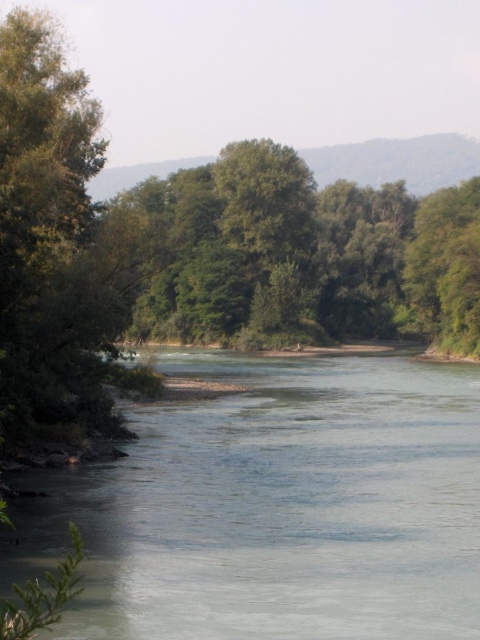
You are standing at the edge of the river and want to cross to the other side. You see the clear water at center and the green leafy tree at left. Which direction should you head to avoid the tree and reach the middle of the river?

You should head towards the right of the green leafy tree at left because the clear water at center is located to the right of the tree, indicating the middle of the river is in that direction.

You are planning to set up a picnic area near the river. You want to choose a spot that is under the shade of the trees. Which tree would provide a larger shaded area? The green leafy tree at left or the green leafy tree at center?

The green leafy tree at center would provide a larger shaded area because it is thicker than the green leafy tree at left.

You are planning to take a photo of the clear water at center and the green leafy tree at left. Based on their sizes in the image, which one should you focus on to ensure it takes up more of your camera frame?

The green leafy tree at left occupies more space in the image than the clear water at center, so focusing on it will ensure it takes up more of your camera frame.